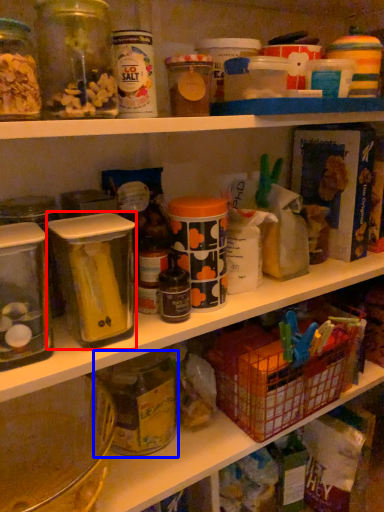
Question: Among these objects, which one is nearest to the camera, carton (highlighted by a red box) or glass jar (highlighted by a blue box)?

Choices:
 (A) carton
 (B) glass jar

Answer: (A)